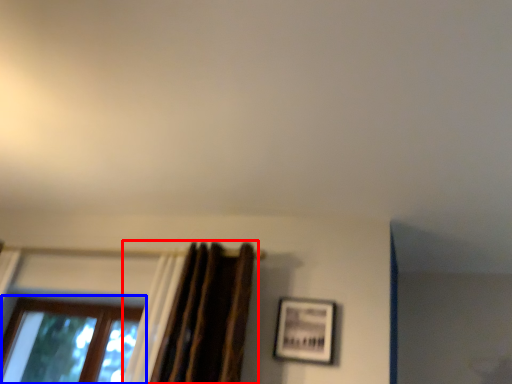
Question: Which object is further to the camera taking this photo, curtain (highlighted by a red box) or window (highlighted by a blue box)?

Choices:
 (A) curtain
 (B) window

Answer: (B)